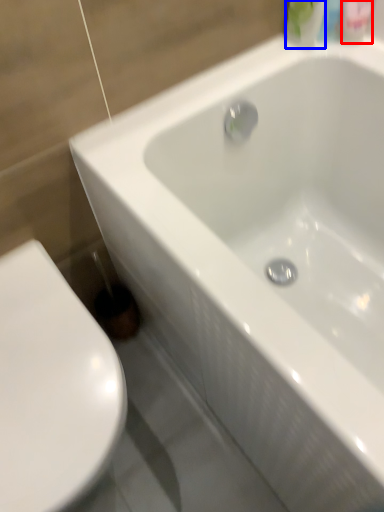
Question: Which object appears farthest to the camera in this image, mouthwash (highlighted by a red box) or mouthwash (highlighted by a blue box)?

Choices:
 (A) mouthwash
 (B) mouthwash

Answer: (A)